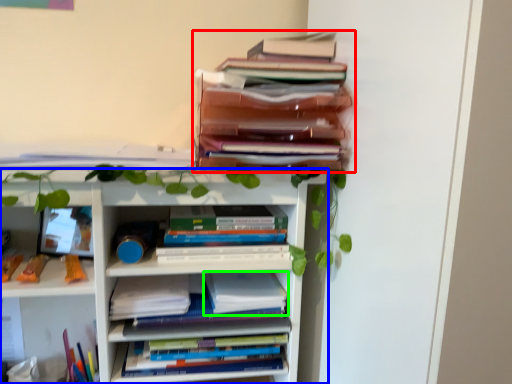
Question: Which is farther away from book (highlighted by a red box)? bookcase (highlighted by a blue box) or paperback book (highlighted by a green box)?

Choices:
 (A) bookcase
 (B) paperback book

Answer: (B)